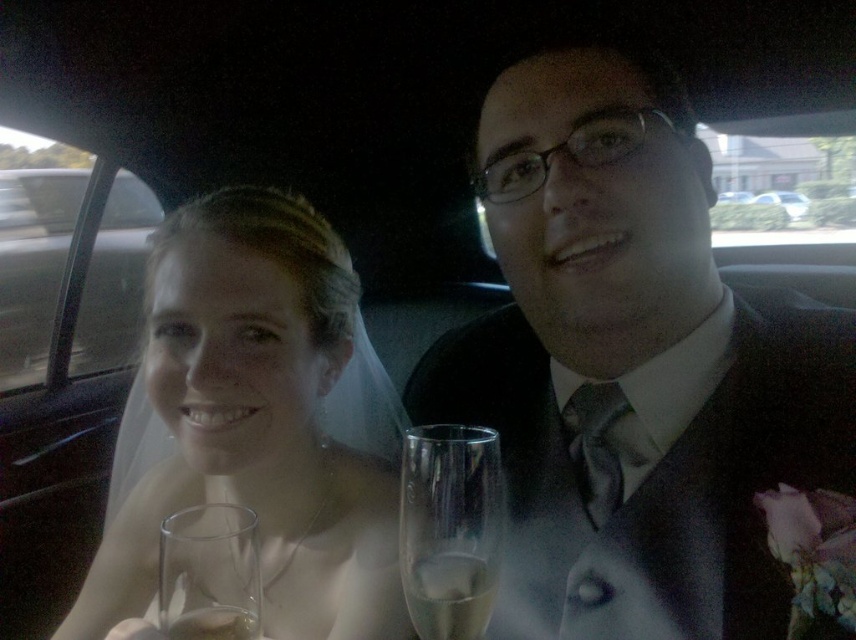
Does matte black suit at center have a lesser height compared to clear glass at left?

Yes.

Looking at this image, can you confirm if matte black suit at center is bigger than clear glass at left?

No, matte black suit at center is not bigger than clear glass at left.

Is point (550, 534) in front of point (129, 264)?

Yes, it is in front of point (129, 264).

Find the location of `matte black suit at center`. matte black suit at center is located at coordinates (632, 365).

Is matte black suit at center bigger than translucent white veil at upper left?

No.

Does matte black suit at center have a greater width compared to translucent white veil at upper left?

No, matte black suit at center is not wider than translucent white veil at upper left.

Is point (507, 605) positioned after point (143, 518)?

No, it is in front of (143, 518).

At what (x,y) coordinates should I click in order to perform the action: click on matte black suit at center. Please return your answer as a coordinate pair (x, y). Looking at the image, I should click on (632, 365).

Between clear glass wine glass at lower left and clear glass at center, which one is positioned lower?

clear glass at center is lower down.

Does clear glass wine glass at lower left appear over clear glass at center?

Indeed, clear glass wine glass at lower left is positioned over clear glass at center.

This screenshot has height=640, width=856. What do you see at coordinates (209, 573) in the screenshot? I see `clear glass wine glass at lower left` at bounding box center [209, 573].

You are a GUI agent. You are given a task and a screenshot of the screen. Output one action in this format:
    pyautogui.click(x=<x>, y=<y>)
    Task: Click on the clear glass wine glass at lower left
    Image resolution: width=856 pixels, height=640 pixels.
    Given the screenshot: What is the action you would take?
    pos(209,573)